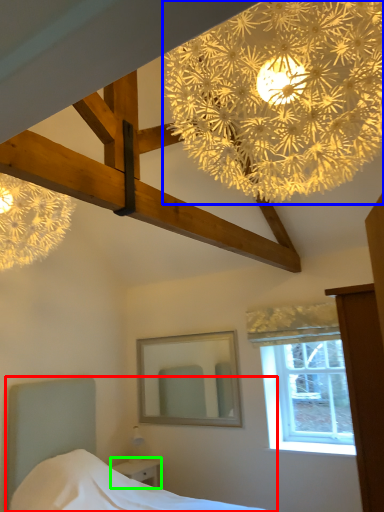
Question: Based on their relative distances, which object is nearer to bed (highlighted by a red box)? Choose from flower (highlighted by a blue box) and nightstand (highlighted by a green box).

Choices:
 (A) flower
 (B) nightstand

Answer: (B)